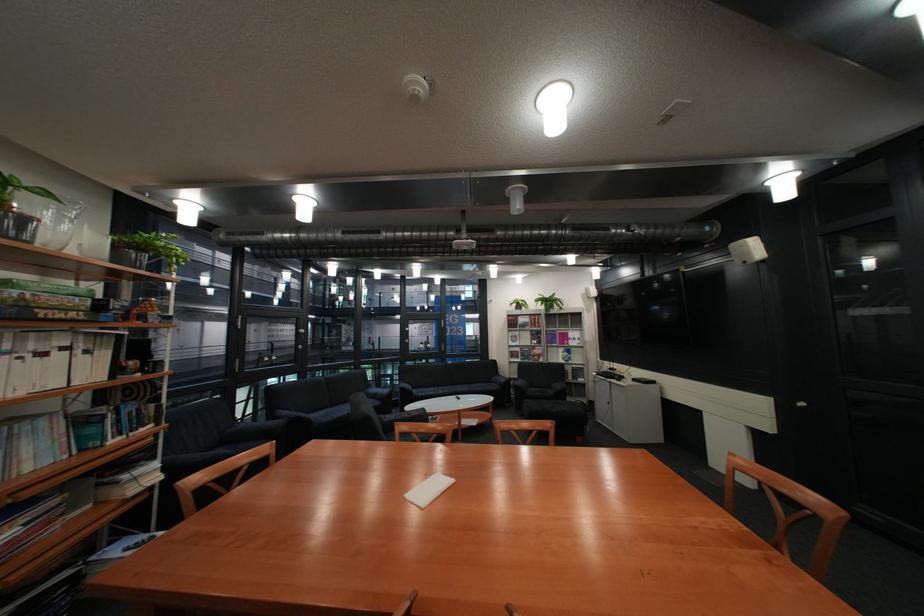
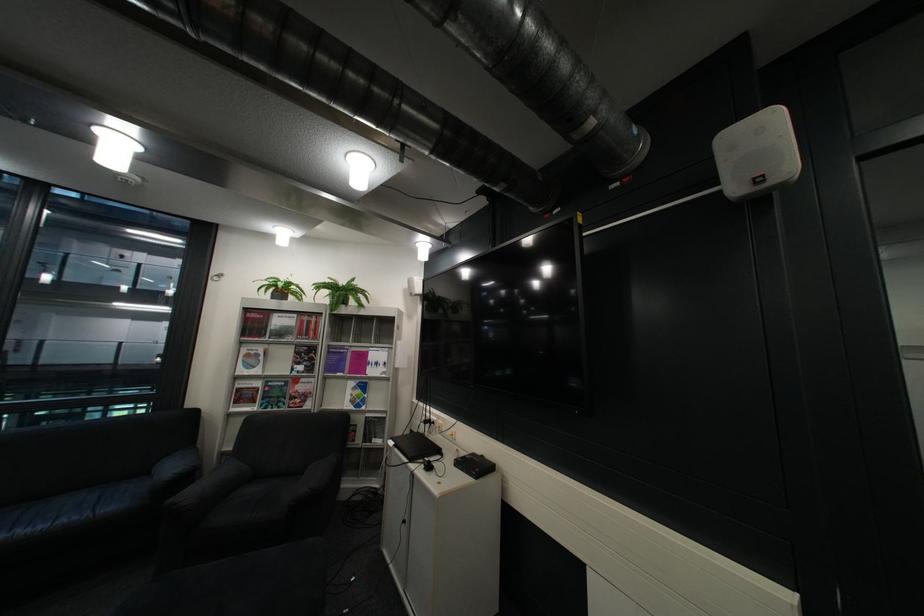
Find the pixel in the second image that matches point (603, 297) in the first image.

(427, 294)